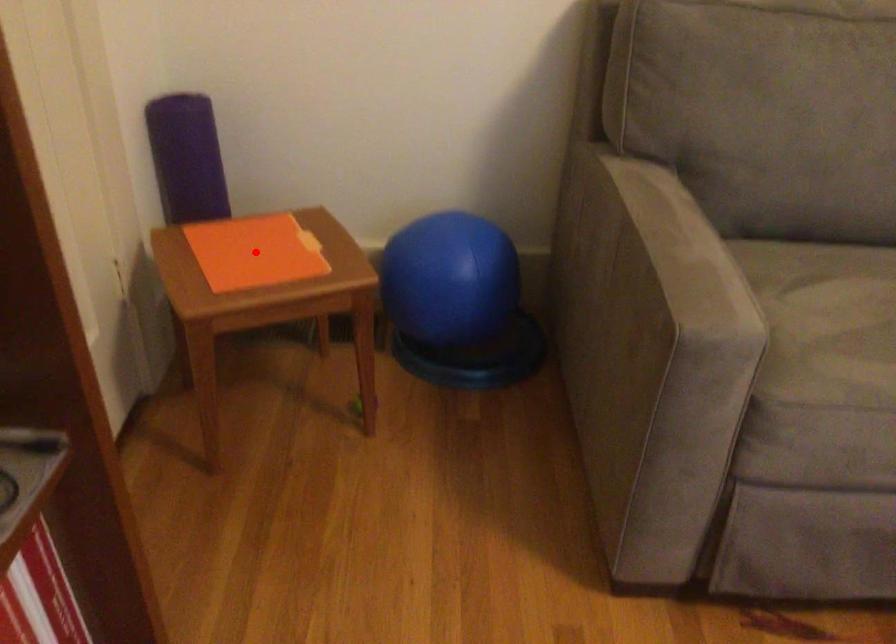
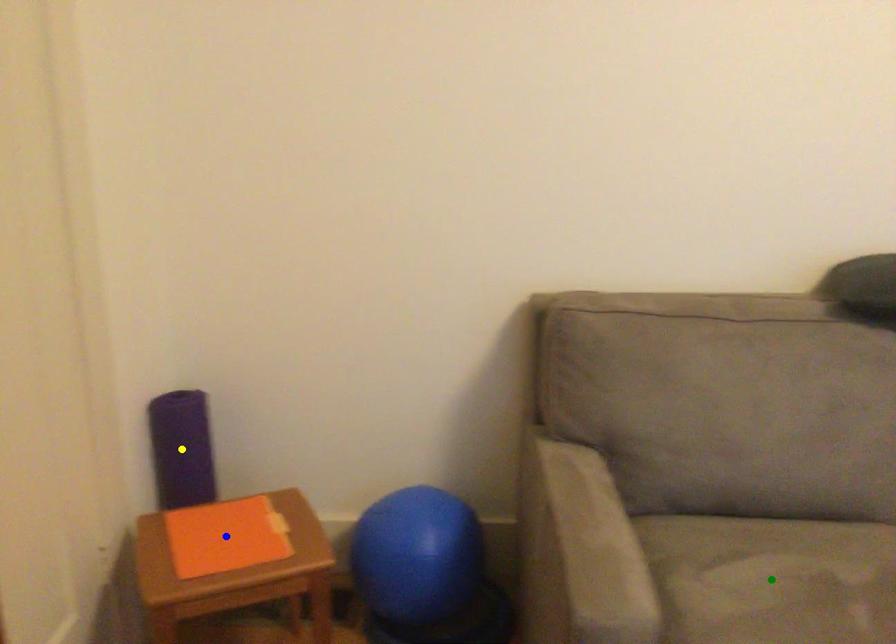
Question: I am providing you with two images of the same scene from different viewpoints. A red point is marked on the first image. You are given multiple points on the second image. Which spot in image 2 lines up with the point in image 1?

Choices:
 (A) green point
 (B) yellow point
 (C) blue point

Answer: (C)